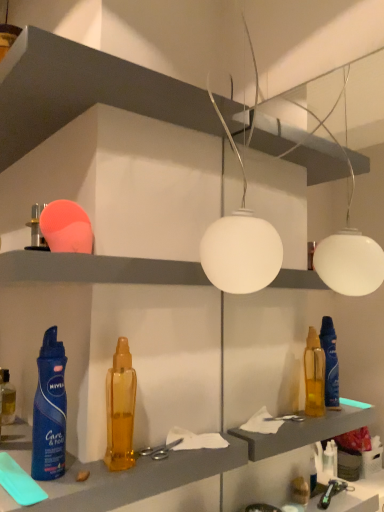
Question: Which direction should I rotate to look at white matte shelf at upper center, the 2th shelf from the bottom?

Choices:
 (A) left
 (B) right

Answer: (A)

Question: Can we say translucent amber bottle at center, which is the third bottle in left-to-right order, lies outside translucent plastic bottle at center?

Choices:
 (A) no
 (B) yes

Answer: (B)

Question: Does translucent amber bottle at center, the 2th bottle when ordered from back to front, turn towards translucent plastic bottle at center?

Choices:
 (A) no
 (B) yes

Answer: (A)

Question: Is translucent amber bottle at center, the 2th bottle viewed from the front, far from translucent plastic bottle at center?

Choices:
 (A) yes
 (B) no

Answer: (B)

Question: Can you confirm if translucent amber bottle at center, the 2th bottle when ordered from back to front, is wider than translucent plastic bottle at center?

Choices:
 (A) no
 (B) yes

Answer: (A)

Question: Can you confirm if translucent amber bottle at center, the 2th bottle when ordered from back to front, is smaller than translucent plastic bottle at center?

Choices:
 (A) no
 (B) yes

Answer: (B)

Question: Is translucent amber bottle at center, the 2th bottle viewed from the front, to the right of translucent plastic bottle at center from the viewer's perspective?

Choices:
 (A) no
 (B) yes

Answer: (B)

Question: Is translucent amber bottle at lower left, acting as the first bottle starting from the left, located within white matte shelf at upper center, arranged as the first shelf when viewed from the top?

Choices:
 (A) no
 (B) yes

Answer: (A)

Question: Is white matte shelf at upper center, arranged as the first shelf when viewed from the top, turned away from translucent amber bottle at lower left, which is the 1th bottle in back-to-front order?

Choices:
 (A) no
 (B) yes

Answer: (A)

Question: Does white matte shelf at upper center, arranged as the first shelf when viewed from the top, lie behind translucent amber bottle at lower left, which is the 1th bottle in back-to-front order?

Choices:
 (A) yes
 (B) no

Answer: (B)

Question: From the image's perspective, is white matte shelf at upper center, the 2th shelf from the bottom, above translucent amber bottle at lower left, which is counted as the 3th bottle, starting from the right?

Choices:
 (A) no
 (B) yes

Answer: (B)

Question: Is white matte shelf at upper center, the 2th shelf from the bottom, smaller than translucent amber bottle at lower left, acting as the first bottle starting from the left?

Choices:
 (A) no
 (B) yes

Answer: (A)

Question: Can you confirm if white matte shelf at upper center, the 2th shelf from the bottom, is positioned to the right of translucent amber bottle at lower left, which is counted as the 3th bottle, starting from the right?

Choices:
 (A) yes
 (B) no

Answer: (A)

Question: Is translucent amber bottle at center, the 2th bottle viewed from the front, outside of matte plastic shelf at upper center, arranged as the first shelf when ordered from the bottom?

Choices:
 (A) yes
 (B) no

Answer: (A)